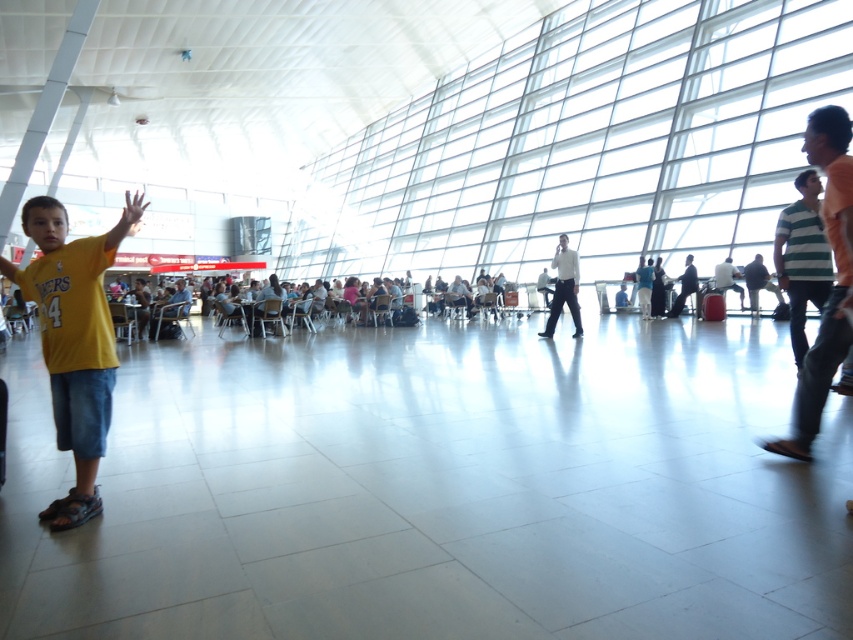
Does yellow matte shirt at left have a larger size compared to dark gray suit at center?

Yes, yellow matte shirt at left is bigger than dark gray suit at center.

Is point (54, 413) in front of point (683, 262)?

Yes, point (54, 413) is closer to viewer.

Identify the location of yellow matte shirt at left. (74, 339).

Does white smooth shirt at center appear under dark gray suit at center?

Yes, white smooth shirt at center is below dark gray suit at center.

Which is in front, point (556, 292) or point (689, 291)?

Point (556, 292) is more forward.

Who is more distant from viewer, [567,266] or [691,284]?

Point [691,284]

This screenshot has height=640, width=853. Find the location of `white smooth shirt at center`. white smooth shirt at center is located at coordinates (564, 288).

Can you confirm if yellow matte shirt at left is thinner than white smooth shirt at center?

Incorrect, yellow matte shirt at left's width is not less than white smooth shirt at center's.

Can you confirm if yellow matte shirt at left is taller than white smooth shirt at center?

No.

This screenshot has height=640, width=853. Describe the element at coordinates (74, 339) in the screenshot. I see `yellow matte shirt at left` at that location.

Image resolution: width=853 pixels, height=640 pixels. In order to click on yellow matte shirt at left in this screenshot , I will do coord(74,339).